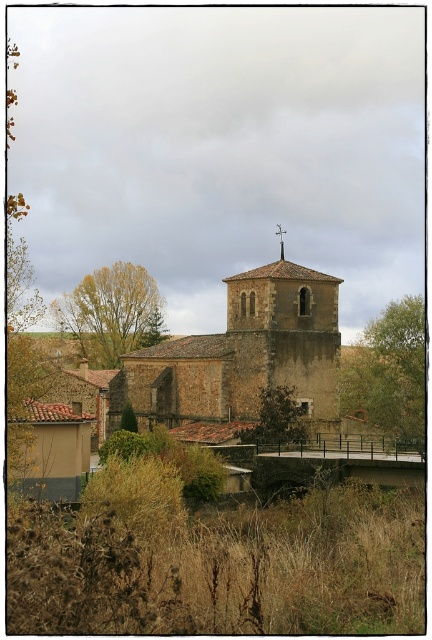
You are an architect visiting a historic site and see the brown stone church tower at center and the brown textured tree at center. Which structure appears bigger in the image?

The brown stone church tower at center is larger in size than the brown textured tree at center, so the church tower appears bigger.